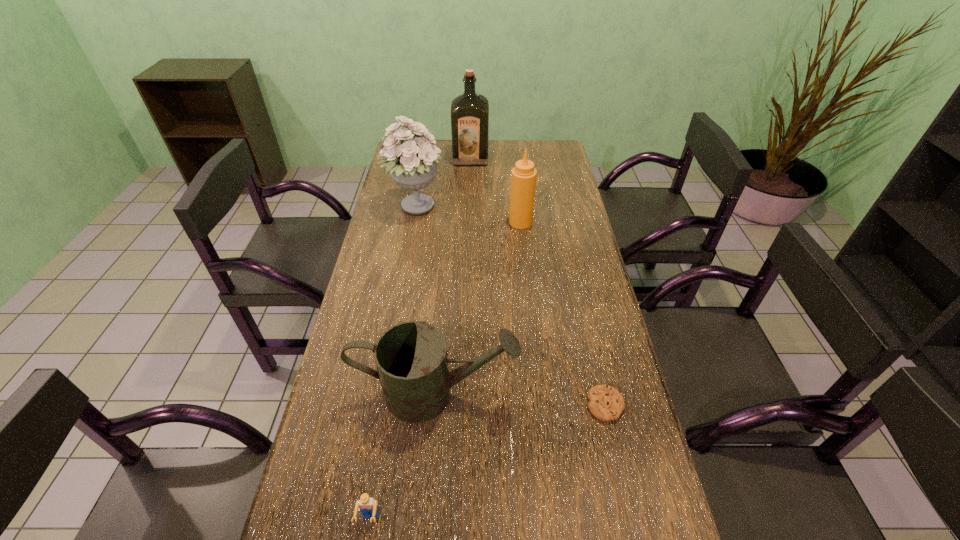
Find the location of `vacant area at the right edge of the desktop`. vacant area at the right edge of the desktop is located at coordinates (606, 424).

In order to click on unoccupied position between the watering can and the Lego in this screenshot , I will do `click(403, 457)`.

Locate an element on the screen. This screenshot has width=960, height=540. free space between the watering can and the fifth tallest object is located at coordinates (403, 457).

Where is `free area in between the second object from right to left and the third shortest object`? free area in between the second object from right to left and the third shortest object is located at coordinates (478, 308).

Identify the location of vacant area that lies between the third tallest object and the cookie. This screenshot has height=540, width=960. (563, 314).

I want to click on free space between the rightmost object and the third tallest object, so click(x=563, y=314).

Identify the location of vacant space that's between the bouquet and the watering can. (425, 300).

Locate an element on the screen. This screenshot has height=540, width=960. empty space between the nearest object and the third shortest object is located at coordinates (403, 457).

Point out which object is positioned as the fourth nearest to the farthest object. Please provide its 2D coordinates. Your answer should be formatted as a tuple, i.e. [(x, y)], where the tuple contains the x and y coordinates of a point satisfying the conditions above.

[(606, 403)]

Identify which object is located as the second nearest to the fourth shortest object. Please provide its 2D coordinates. Your answer should be formatted as a tuple, i.e. [(x, y)], where the tuple contains the x and y coordinates of a point satisfying the conditions above.

[(469, 111)]